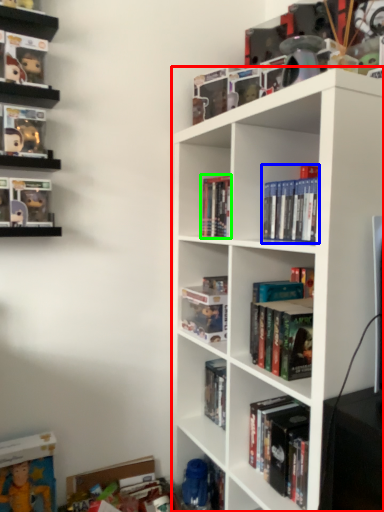
Question: Which object is positioned closest to shelf (highlighted by a red box)? Select from book (highlighted by a blue box) and book (highlighted by a green box).

Choices:
 (A) book
 (B) book

Answer: (A)